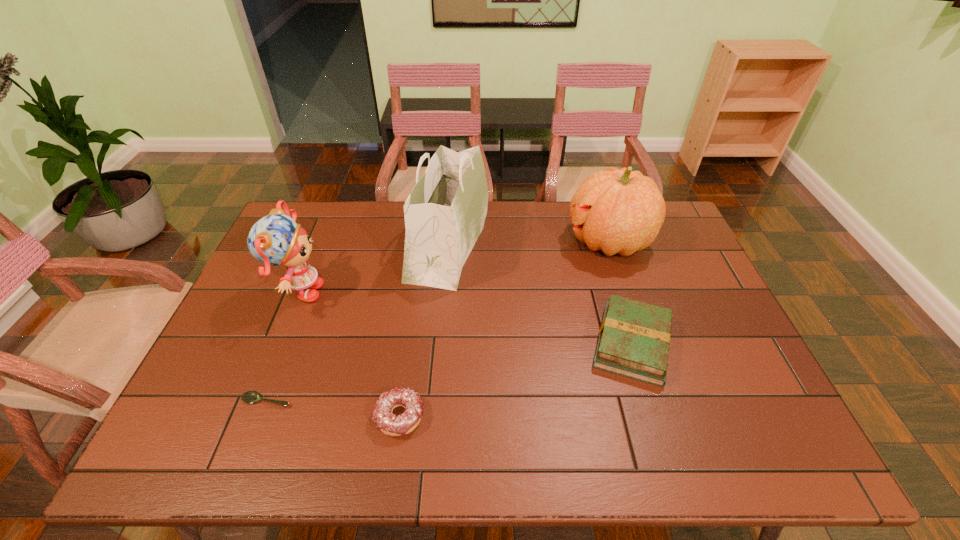
At what (x,y) coordinates should I click in order to perform the action: click on unoccupied area between the doughnut and the soupspoon. Please return your answer as a coordinate pair (x, y). This screenshot has height=540, width=960. Looking at the image, I should click on (333, 408).

I want to click on empty space that is in between the book and the doughnut, so click(516, 380).

I want to click on vacant area that lies between the doll and the soupspoon, so click(283, 347).

The height and width of the screenshot is (540, 960). Find the location of `empty space that is in between the book and the soupspoon`. empty space that is in between the book and the soupspoon is located at coordinates (449, 372).

Where is `vacant region between the soupspoon and the book`? The height and width of the screenshot is (540, 960). vacant region between the soupspoon and the book is located at coordinates (449, 372).

This screenshot has width=960, height=540. I want to click on vacant space that is in between the doll and the fifth tallest object, so click(349, 355).

Select which object is the fourth closest to the pumpkin. Please provide its 2D coordinates. Your answer should be formatted as a tuple, i.e. [(x, y)], where the tuple contains the x and y coordinates of a point satisfying the conditions above.

[(276, 239)]

This screenshot has height=540, width=960. In order to click on object that is the fourth closest to the pumpkin in this screenshot , I will do `click(276, 239)`.

Where is `blank space that satisfies the following two spatial constraints: 1. on the front side of the grocery bag; 2. on the face of the doll`? The height and width of the screenshot is (540, 960). blank space that satisfies the following two spatial constraints: 1. on the front side of the grocery bag; 2. on the face of the doll is located at coordinates (444, 293).

Locate an element on the screen. vacant region that satisfies the following two spatial constraints: 1. on the face of the doughnut; 2. on the right side of the doll is located at coordinates (249, 416).